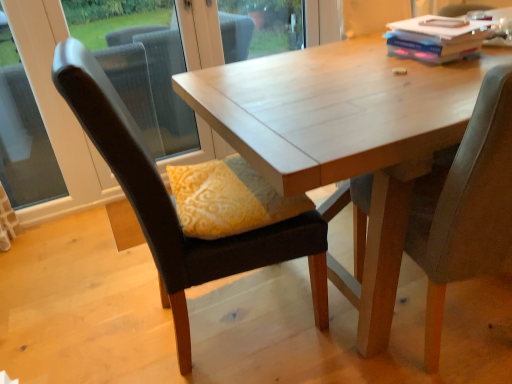
I want to click on vacant area situated below velvet dark brown chair at center, placed as the 1th chair when sorted from left to right (from a real-world perspective), so click(212, 322).